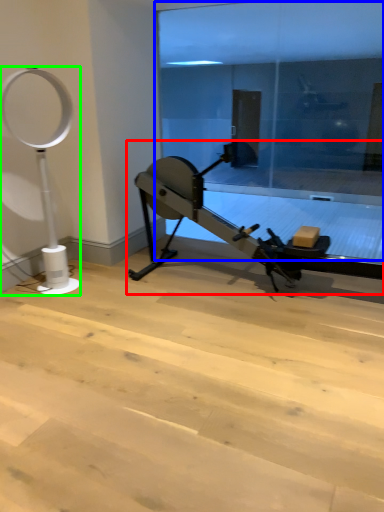
Question: Based on their relative distances, which object is farther from stationary bicycle (highlighted by a red box)? Choose from glass door (highlighted by a blue box) and basketball hoop (highlighted by a green box).

Choices:
 (A) glass door
 (B) basketball hoop

Answer: (A)